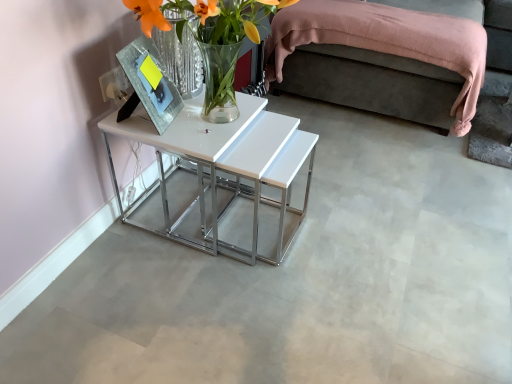
This screenshot has height=384, width=512. What are the coordinates of `space that is in front of white glossy table at center` in the screenshot? It's located at (192, 306).